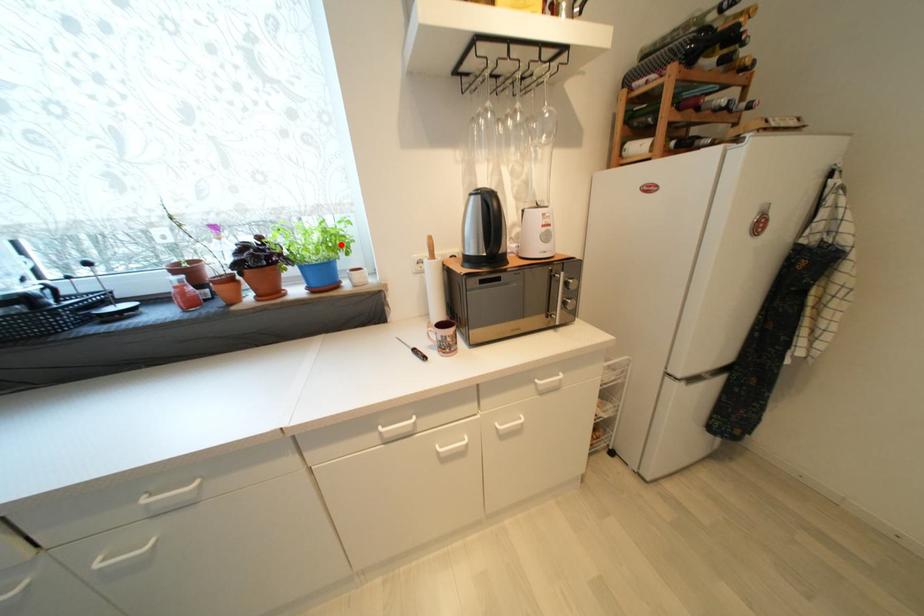
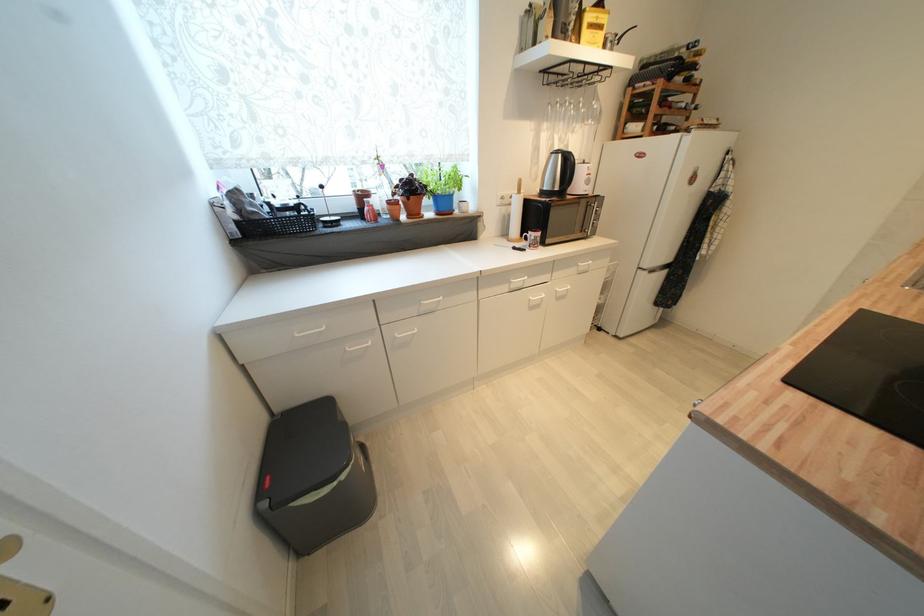
Where in the second image is the point corresponding to the highlighted location from the first image?

(463, 184)